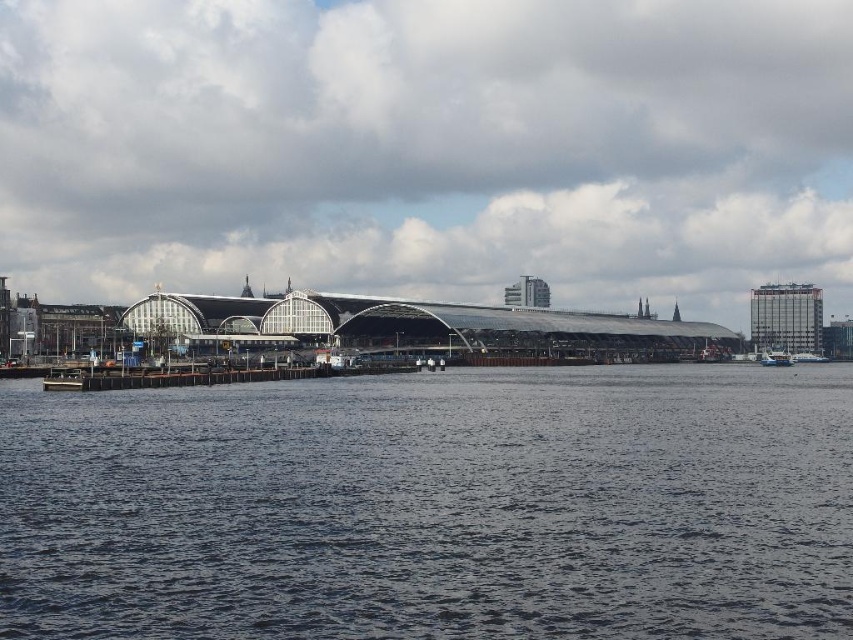
You are a tourist standing on the dock and want to take a photo of the transparent glass building at center and the dark blue water at center. Which object should you focus on first if you want to capture both in one shot?

The transparent glass building at center is located above dark blue water at center, so you should focus on the transparent glass building at center first to ensure both are in focus.

You are standing on the dock and see two boats in the water. The metallic silver boat at lower right and the white glossy boat at lower right. Which boat is closer to the left side of the dock?

The metallic silver boat at lower right is closer to the left side of the dock because it is positioned to the left of the white glossy boat at lower right.

You are a photographer standing at the waterfront and want to capture the transparent glass building at center in your shot. Given that your camera can focus on objects up to 300 meters away, will you be able to take a clear photo of it?

The transparent glass building at center is 331.23 meters from camera, which is beyond the camera maximum focus range of 300 meters. Therefore, the camera cannot focus on it clearly.